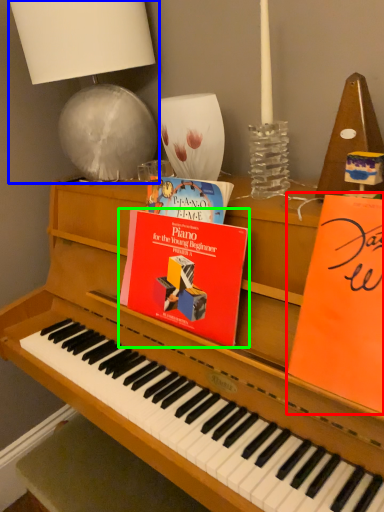
Question: Which object is positioned farthest from paperback book (highlighted by a red box)? Select from table lamp (highlighted by a blue box) and paperback book (highlighted by a green box).

Choices:
 (A) table lamp
 (B) paperback book

Answer: (A)